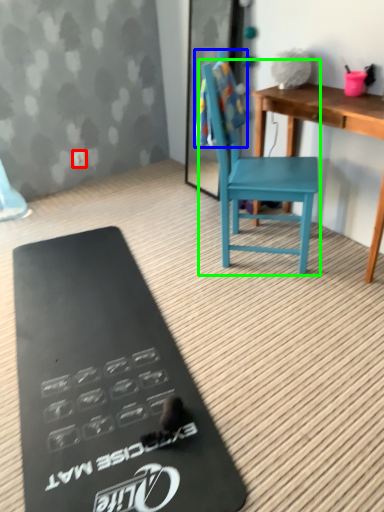
Question: Estimate the real-world distances between objects in this image. Which object is closer to power outlet (highlighted by a red box), towel/napkin (highlighted by a blue box) or armchair (highlighted by a green box)?

Choices:
 (A) towel/napkin
 (B) armchair

Answer: (A)